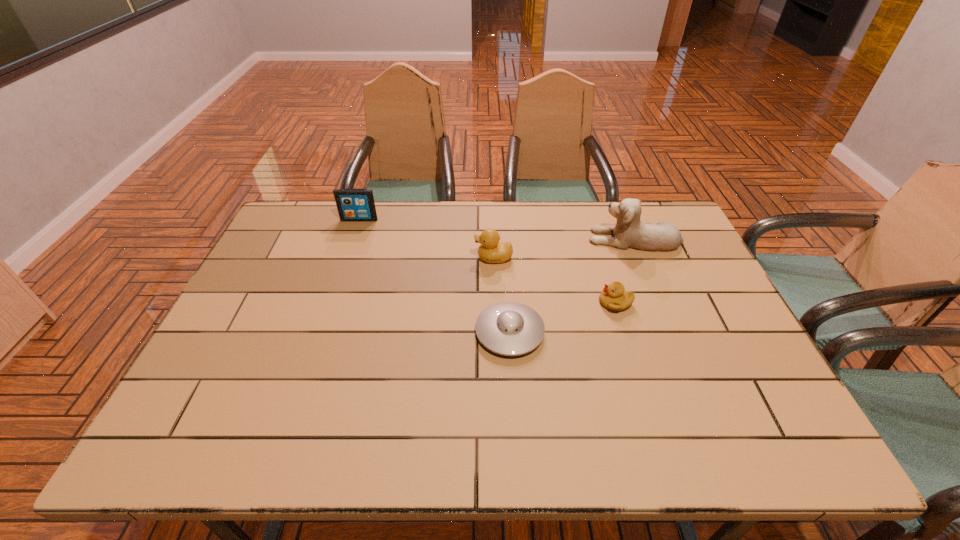
This screenshot has width=960, height=540. In order to click on the tallest object in this screenshot , I will do [x=629, y=232].

The image size is (960, 540). What are the coordinates of `the leftmost object` in the screenshot? It's located at (353, 204).

In order to click on iPod in this screenshot , I will do `click(353, 204)`.

In order to click on the left duckling in this screenshot , I will do `click(491, 250)`.

At what (x,y) coordinates should I click in order to perform the action: click on the farther duckling. Please return your answer as a coordinate pair (x, y). The height and width of the screenshot is (540, 960). Looking at the image, I should click on (491, 250).

At what (x,y) coordinates should I click in order to perform the action: click on the shorter duckling. Please return your answer as a coordinate pair (x, y). The image size is (960, 540). Looking at the image, I should click on (614, 297).

Locate an element on the screen. This screenshot has height=540, width=960. the right duckling is located at coordinates (614, 297).

The height and width of the screenshot is (540, 960). Find the location of `the shortest object`. the shortest object is located at coordinates (507, 328).

Identify the location of free point located 0.290m on the front-facing side of the tallest object. This screenshot has width=960, height=540. (499, 239).

Where is `free space located on the front-facing side of the tallest object`? This screenshot has height=540, width=960. free space located on the front-facing side of the tallest object is located at coordinates (484, 239).